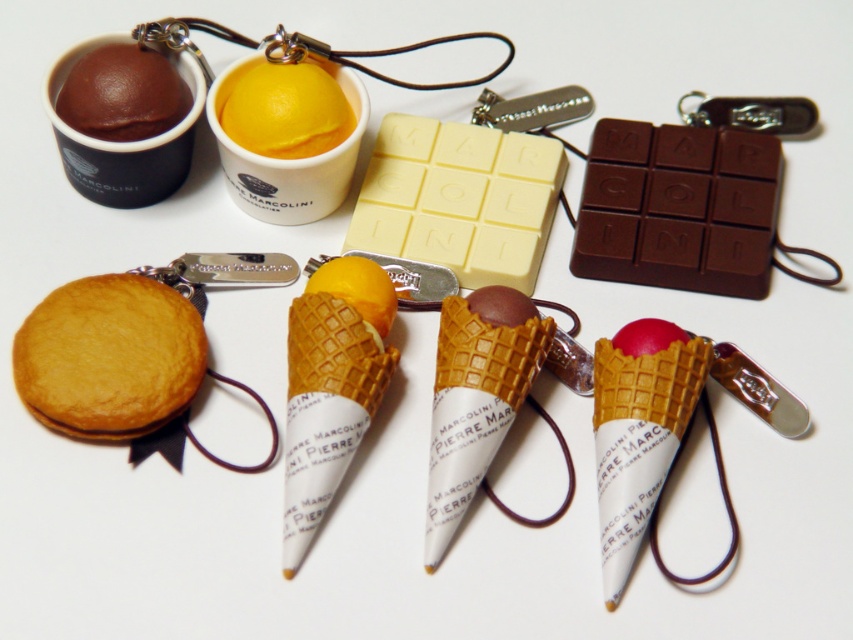
Question: Which of the following is the closest to the observer?

Choices:
 (A) matte pink ice cream at center
 (B) matte brown chocolate at upper left

Answer: (A)

Question: Among these objects, which one is nearest to the camera?

Choices:
 (A) yellow matte ice cream cone at center
 (B) matte brown chocolate at upper left

Answer: (A)

Question: Is golden matte cookie at lower left below chocolate matte ice cream cone at center?

Choices:
 (A) yes
 (B) no

Answer: (B)

Question: Can you confirm if chocolate matte ice cream cone at center is smaller than yellow matte ice cream cone at center?

Choices:
 (A) no
 (B) yes

Answer: (A)

Question: Which of the following is the farthest from the observer?

Choices:
 (A) yellow matte ice cream cone at center
 (B) matte brown chocolate at upper left

Answer: (B)

Question: Is matte pink ice cream at center above chocolate matte ice cream cone at center?

Choices:
 (A) no
 (B) yes

Answer: (A)